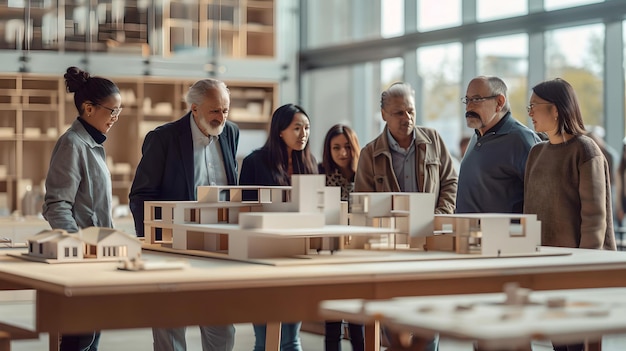
This screenshot has width=626, height=351. Identify the location of tables. (226, 310).